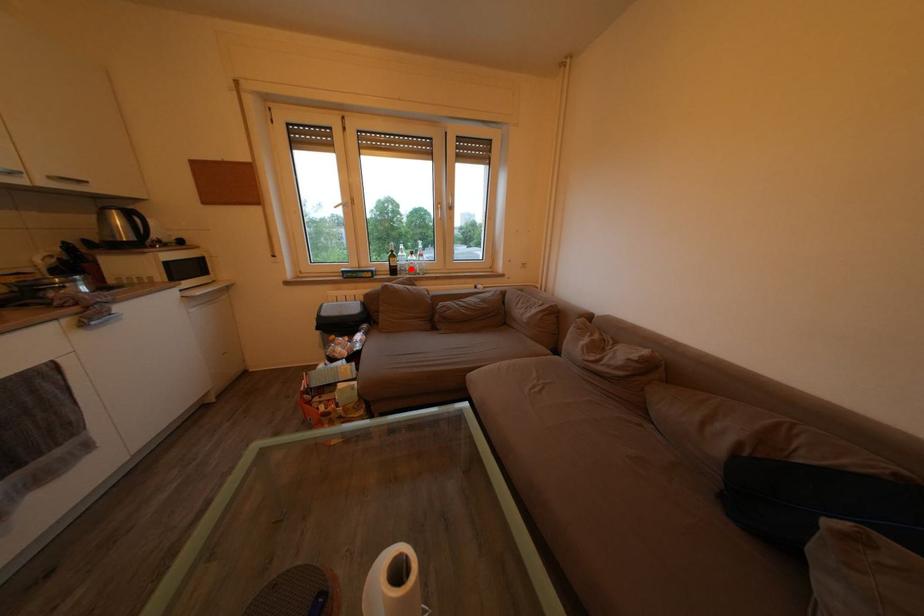
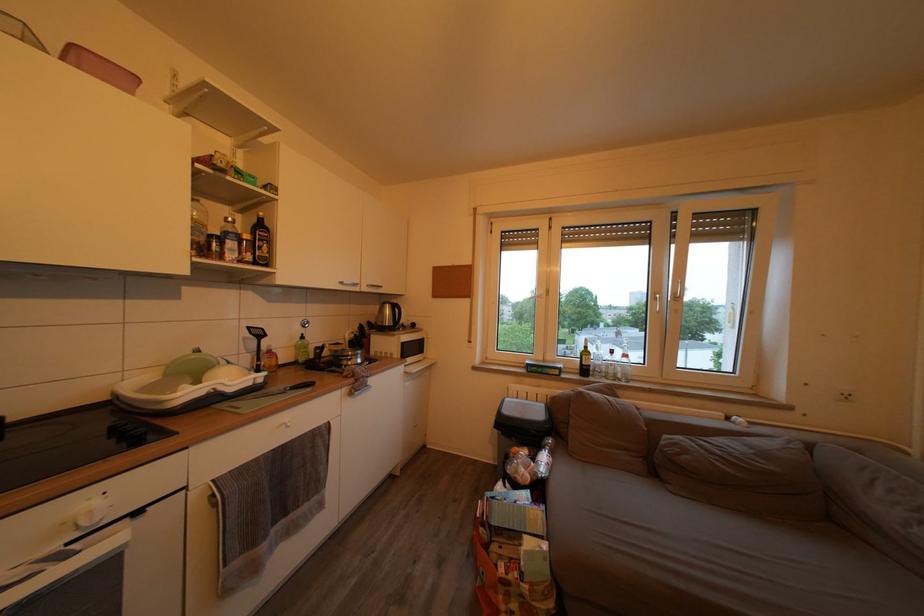
Find the pixel in the second image that matches the highlighted location in the first image.

(608, 369)